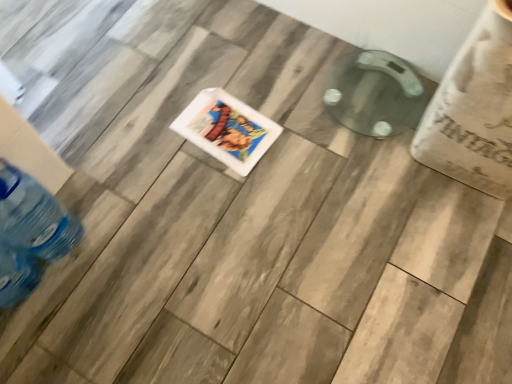
At what (x,y) coordinates should I click in order to perform the action: click on translucent plastic bottle at lower left. Please return your answer as a coordinate pair (x, y). Looking at the image, I should click on (34, 216).

The image size is (512, 384). What do you see at coordinates (34, 216) in the screenshot? I see `translucent plastic bottle at lower left` at bounding box center [34, 216].

Where is `white glossy comic book at center`? white glossy comic book at center is located at coordinates (227, 129).

What do you see at coordinates (227, 129) in the screenshot? This screenshot has width=512, height=384. I see `white glossy comic book at center` at bounding box center [227, 129].

At what (x,y) coordinates should I click in order to perform the action: click on translucent plastic bottle at lower left. Please return your answer as a coordinate pair (x, y). This screenshot has width=512, height=384. Looking at the image, I should click on (34, 216).

In the image, is white glossy comic book at center on the left side or the right side of translucent plastic bottle at lower left?

In the image, white glossy comic book at center appears on the right side of translucent plastic bottle at lower left.

Does white glossy comic book at center lie in front of translucent plastic bottle at lower left?

No, the depth of white glossy comic book at center is greater than that of translucent plastic bottle at lower left.

Which point is more forward, (x=241, y=102) or (x=11, y=204)?

Point (x=11, y=204)

From the image's perspective, is white glossy comic book at center above or below translucent plastic bottle at lower left?

From the image's perspective, white glossy comic book at center appears above translucent plastic bottle at lower left.

From a real-world perspective, does white glossy comic book at center stand above translucent plastic bottle at lower left?

No, from a real-world perspective, white glossy comic book at center is not above translucent plastic bottle at lower left.

Considering the sizes of objects white glossy comic book at center and translucent plastic bottle at lower left in the image provided, who is thinner, white glossy comic book at center or translucent plastic bottle at lower left?

Thinner between the two is translucent plastic bottle at lower left.

Does white glossy comic book at center have a greater height compared to translucent plastic bottle at lower left?

No, white glossy comic book at center is not taller than translucent plastic bottle at lower left.

Considering the sizes of objects white glossy comic book at center and translucent plastic bottle at lower left in the image provided, who is smaller, white glossy comic book at center or translucent plastic bottle at lower left?

With smaller size is white glossy comic book at center.

Is white glossy comic book at center completely or partially outside of translucent plastic bottle at lower left?

Indeed, white glossy comic book at center is completely outside translucent plastic bottle at lower left.

Is white glossy comic book at center far from translucent plastic bottle at lower left?

Actually, white glossy comic book at center and translucent plastic bottle at lower left are a little close together.

Could you tell me if white glossy comic book at center is facing translucent plastic bottle at lower left?

No, white glossy comic book at center is not oriented towards translucent plastic bottle at lower left.

Where is `bottle in front of the white glossy comic book at center`? Image resolution: width=512 pixels, height=384 pixels. bottle in front of the white glossy comic book at center is located at coordinates (34, 216).

Considering the relative positions of translucent plastic bottle at lower left and white glossy comic book at center in the image provided, is translucent plastic bottle at lower left to the right of white glossy comic book at center from the viewer's perspective?

No.

Which object is further away from the camera, translucent plastic bottle at lower left or white glossy comic book at center?

white glossy comic book at center is more distant.

Is point (79, 232) positioned before point (197, 130)?

That is True.

From the image's perspective, does translucent plastic bottle at lower left appear lower than white glossy comic book at center?

Correct, translucent plastic bottle at lower left appears lower than white glossy comic book at center in the image.

From a real-world perspective, does translucent plastic bottle at lower left sit lower than white glossy comic book at center?

No, from a real-world perspective, translucent plastic bottle at lower left is not beneath white glossy comic book at center.

Does translucent plastic bottle at lower left have a lesser width compared to white glossy comic book at center?

Yes.

Considering the sizes of objects translucent plastic bottle at lower left and white glossy comic book at center in the image provided, who is taller, translucent plastic bottle at lower left or white glossy comic book at center?

translucent plastic bottle at lower left is taller.

Between translucent plastic bottle at lower left and white glossy comic book at center, which one has larger size?

Bigger between the two is translucent plastic bottle at lower left.

Is translucent plastic bottle at lower left inside the boundaries of white glossy comic book at center, or outside?

translucent plastic bottle at lower left is spatially situated outside white glossy comic book at center.

Is translucent plastic bottle at lower left in contact with white glossy comic book at center?

translucent plastic bottle at lower left and white glossy comic book at center are clearly separated.

Is translucent plastic bottle at lower left positioned with its back to white glossy comic book at center?

That's not correct — translucent plastic bottle at lower left is not looking away from white glossy comic book at center.

How distant is translucent plastic bottle at lower left from white glossy comic book at center?

A distance of 20.53 inches exists between translucent plastic bottle at lower left and white glossy comic book at center.

Find the location of a particular element. comic book above the translucent plastic bottle at lower left (from the image's perspective) is located at coordinates (227, 129).

Image resolution: width=512 pixels, height=384 pixels. In order to click on bottle in front of the white glossy comic book at center in this screenshot , I will do `click(34, 216)`.

Locate an element on the screen. This screenshot has height=384, width=512. comic book below the translucent plastic bottle at lower left (from a real-world perspective) is located at coordinates (227, 129).